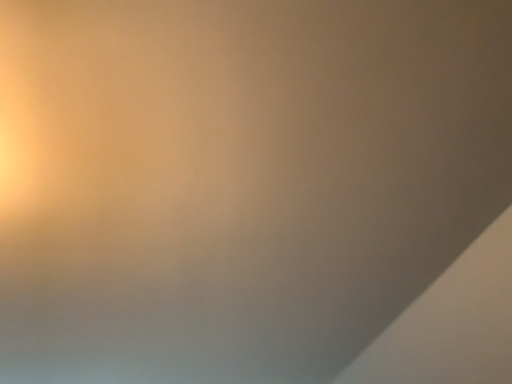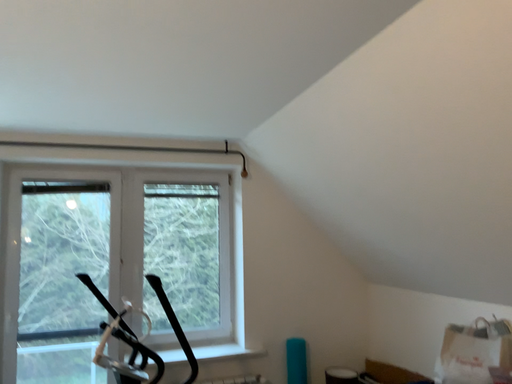
Question: How did the camera likely rotate when shooting the video?

Choices:
 (A) rotated left
 (B) rotated right

Answer: (B)